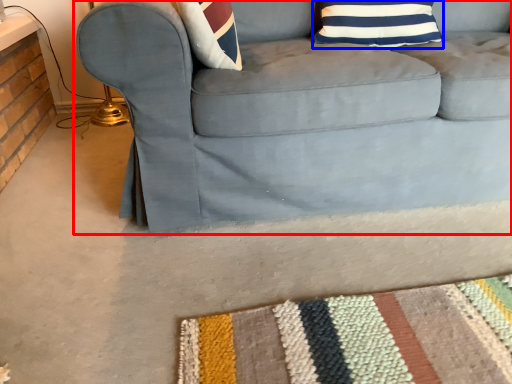
Question: Which object appears farthest to the camera in this image, studio couch (highlighted by a red box) or pillow (highlighted by a blue box)?

Choices:
 (A) studio couch
 (B) pillow

Answer: (B)